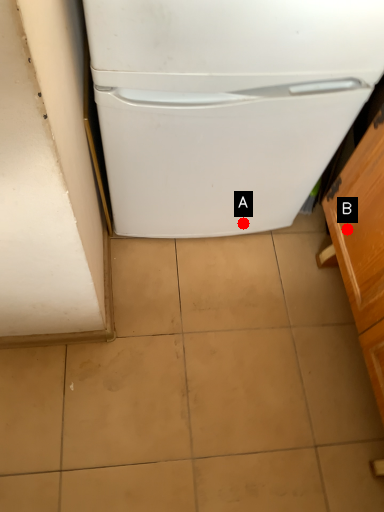
Question: Two points are circled on the image, labeled by A and B beside each circle. Which of the following is the closest to the observer?

Choices:
 (A) A is closer
 (B) B is closer

Answer: (B)